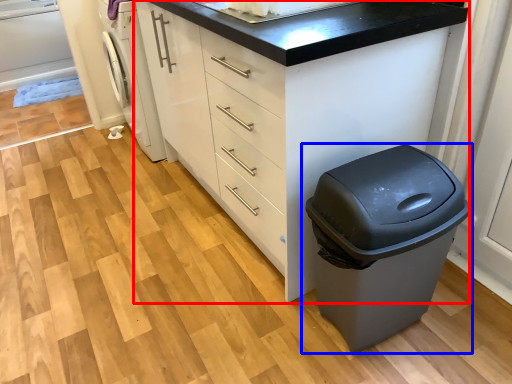
Question: Which of the following is the closest to the observer, chest of drawers (highlighted by a red box) or waste container (highlighted by a blue box)?

Choices:
 (A) chest of drawers
 (B) waste container

Answer: (B)